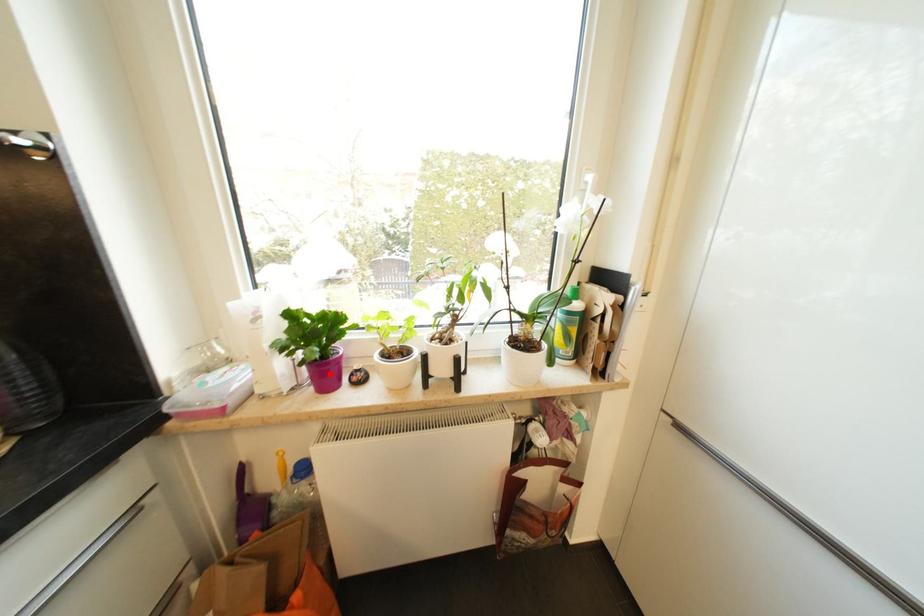
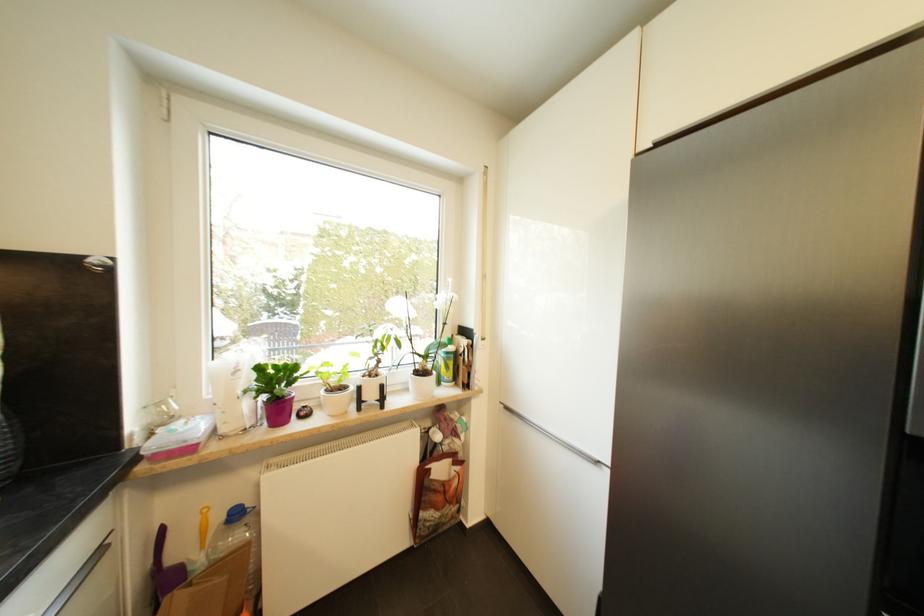
In the second image, find the point that corresponds to the highlighted location in the first image.

(285, 411)